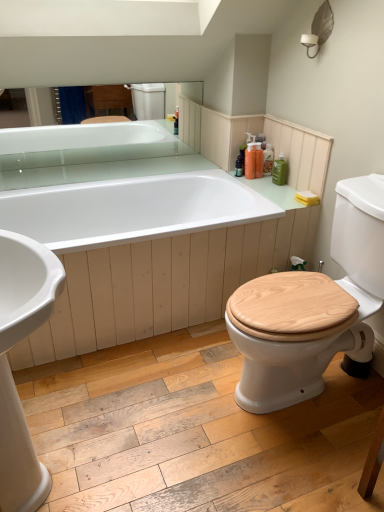
Measure the distance between point (321, 336) and camera.

They are 1.37 meters apart.

Measure the distance between translucent plastic bottles at upper right, which is counted as the second toiletry, starting from the left, and camera.

translucent plastic bottles at upper right, which is counted as the second toiletry, starting from the left, is 7.39 feet from camera.

The image size is (384, 512). Describe the element at coordinates (268, 159) in the screenshot. I see `translucent plastic bottles at upper right, the second toiletry in the right-to-left sequence` at that location.

What is the approximate width of translucent orange bottle at upper right, the third toiletry from the right?

translucent orange bottle at upper right, the third toiletry from the right, is 2.77 inches wide.

Measure the distance between white glossy bathtub at center and camera.

The depth of white glossy bathtub at center is 5.26 feet.

Locate an element on the screen. The width and height of the screenshot is (384, 512). yellow sponge at upper right is located at coordinates (307, 198).

Which point is more forward, (265, 173) or (312, 199)?

The point (312, 199) is in front.

Could you tell me if translucent plastic bottles at upper right, which is counted as the second toiletry, starting from the left, is turned towards yellow sponge at upper right?

No, translucent plastic bottles at upper right, which is counted as the second toiletry, starting from the left, is not facing towards yellow sponge at upper right.

Is translucent plastic bottles at upper right, the second toiletry in the right-to-left sequence, next to yellow sponge at upper right?

translucent plastic bottles at upper right, the second toiletry in the right-to-left sequence, and yellow sponge at upper right are not in contact.

Is translucent plastic bottles at upper right, the second toiletry in the right-to-left sequence, located outside yellow sponge at upper right?

Yes.

Can you tell me how much translucent plastic bottles at upper right, which is counted as the second toiletry, starting from the left, and white glossy bathtub at center differ in facing direction?

They differ by 87.4 degrees in their facing directions.

Is translucent plastic bottles at upper right, the second toiletry in the right-to-left sequence, located outside white glossy bathtub at center?

Indeed, translucent plastic bottles at upper right, the second toiletry in the right-to-left sequence, is completely outside white glossy bathtub at center.

From the image's perspective, who appears lower, translucent plastic bottles at upper right, the second toiletry in the right-to-left sequence, or white glossy bathtub at center?

white glossy bathtub at center appears lower in the image.

From the image's perspective, count 3rd toiletrys upward from the white glossy bathtub at center and point to it. Please provide its 2D coordinates.

[(268, 159)]

Is white glossy bathtub at center further to the viewer compared to wooden at right?

Yes, white glossy bathtub at center is behind wooden at right.

In the image, there is a wooden at right. Where is `bath below it (from a real-world perspective)`? The width and height of the screenshot is (384, 512). bath below it (from a real-world perspective) is located at coordinates (140, 255).

Can you confirm if white glossy bathtub at center is taller than wooden at right?

No.

Could you tell me if translucent plastic bottles at upper right, the second toiletry in the right-to-left sequence, is facing green matte bottle at upper right, the 3th toiletry in the left-to-right sequence?

No, translucent plastic bottles at upper right, the second toiletry in the right-to-left sequence, is not aimed at green matte bottle at upper right, the 3th toiletry in the left-to-right sequence.

Starting from the green matte bottle at upper right, the 1th toiletry viewed from the right, which toiletry is the 1st one to the left? Please provide its 2D coordinates.

[(268, 159)]

Are translucent plastic bottles at upper right, the second toiletry in the right-to-left sequence, and green matte bottle at upper right, the 3th toiletry in the left-to-right sequence, far apart?

They are positioned close to each other.

Is translucent orange bottle at upper right, marked as the first toiletry in a left-to-right arrangement, located outside translucent plastic bottles at upper right, the second toiletry in the right-to-left sequence?

Yes, translucent orange bottle at upper right, marked as the first toiletry in a left-to-right arrangement, is outside of translucent plastic bottles at upper right, the second toiletry in the right-to-left sequence.

Does point (248, 149) appear closer or farther from the camera than point (265, 172)?

Point (248, 149).

From the image's perspective, is translucent orange bottle at upper right, marked as the first toiletry in a left-to-right arrangement, located above or below translucent plastic bottles at upper right, the second toiletry in the right-to-left sequence?

translucent orange bottle at upper right, marked as the first toiletry in a left-to-right arrangement, is below translucent plastic bottles at upper right, the second toiletry in the right-to-left sequence.

Is point (247, 161) less distant than point (310, 313)?

No, (247, 161) is further to viewer.

From a real-world perspective, is translucent orange bottle at upper right, the third toiletry from the right, located higher than wooden at right?

Correct, in the physical world, translucent orange bottle at upper right, the third toiletry from the right, is higher than wooden at right.

Is translucent orange bottle at upper right, the third toiletry from the right, bigger or smaller than wooden at right?

Clearly, translucent orange bottle at upper right, the third toiletry from the right, is smaller in size than wooden at right.

From the image's perspective, which one is positioned higher, translucent orange bottle at upper right, marked as the first toiletry in a left-to-right arrangement, or wooden at right?

translucent orange bottle at upper right, marked as the first toiletry in a left-to-right arrangement.

Is translucent plastic bottles at upper right, the second toiletry in the right-to-left sequence, shorter than translucent orange bottle at upper right, marked as the first toiletry in a left-to-right arrangement?

Incorrect, the height of translucent plastic bottles at upper right, the second toiletry in the right-to-left sequence, does not fall short of that of translucent orange bottle at upper right, marked as the first toiletry in a left-to-right arrangement.

Is translucent plastic bottles at upper right, the second toiletry in the right-to-left sequence, positioned with its back to translucent orange bottle at upper right, marked as the first toiletry in a left-to-right arrangement?

No, translucent plastic bottles at upper right, the second toiletry in the right-to-left sequence, is not facing the opposite direction of translucent orange bottle at upper right, marked as the first toiletry in a left-to-right arrangement.

Is translucent plastic bottles at upper right, the second toiletry in the right-to-left sequence, not near translucent orange bottle at upper right, marked as the first toiletry in a left-to-right arrangement?

translucent plastic bottles at upper right, the second toiletry in the right-to-left sequence, is near translucent orange bottle at upper right, marked as the first toiletry in a left-to-right arrangement, not far away.

Considering the positions of objects translucent plastic bottles at upper right, the second toiletry in the right-to-left sequence, and translucent orange bottle at upper right, marked as the first toiletry in a left-to-right arrangement, in the image provided, who is behind, translucent plastic bottles at upper right, the second toiletry in the right-to-left sequence, or translucent orange bottle at upper right, marked as the first toiletry in a left-to-right arrangement,?

Positioned behind is translucent plastic bottles at upper right, the second toiletry in the right-to-left sequence.

Image resolution: width=384 pixels, height=512 pixels. Find the location of `toilet paper lying on the right of translucent plastic bottles at upper right, the second toiletry in the right-to-left sequence`. toilet paper lying on the right of translucent plastic bottles at upper right, the second toiletry in the right-to-left sequence is located at coordinates (307, 198).

The image size is (384, 512). What are the coordinates of `toiletry that is the 3rd one when counting backward from the white glossy bathtub at center` in the screenshot? It's located at (268, 159).

Looking at the image, which one is located further to white glossy bathtub at center, translucent orange bottle at upper right, the third toiletry from the right, or yellow sponge at upper right?

yellow sponge at upper right is further to white glossy bathtub at center.

Looking at the image, which one is located further to wooden at right, translucent orange bottle at upper right, marked as the first toiletry in a left-to-right arrangement, or white glossy bathtub at center?

Based on the image, translucent orange bottle at upper right, marked as the first toiletry in a left-to-right arrangement, appears to be further to wooden at right.

From the image, which object appears to be nearer to green matte bottle at upper right, the 3th toiletry in the left-to-right sequence, wooden at right or yellow sponge at upper right?

Based on the image, yellow sponge at upper right appears to be nearer to green matte bottle at upper right, the 3th toiletry in the left-to-right sequence.

When comparing their distances from white glossy bathtub at center, does translucent plastic bottles at upper right, which is counted as the second toiletry, starting from the left, or wooden at right seem closer?

wooden at right lies closer to white glossy bathtub at center than the other object.

When comparing their distances from translucent orange bottle at upper right, the third toiletry from the right, does translucent plastic bottles at upper right, the second toiletry in the right-to-left sequence, or yellow sponge at upper right seem further?

yellow sponge at upper right lies further to translucent orange bottle at upper right, the third toiletry from the right, than the other object.

From the image, which object appears to be nearer to white glossy bathtub at center, yellow sponge at upper right or wooden at right?

Based on the image, wooden at right appears to be nearer to white glossy bathtub at center.

Based on their spatial positions, is wooden at right or translucent orange bottle at upper right, the third toiletry from the right, closer to yellow sponge at upper right?

The object closer to yellow sponge at upper right is translucent orange bottle at upper right, the third toiletry from the right.

Looking at the image, which one is located further to green matte bottle at upper right, the 1th toiletry viewed from the right, translucent orange bottle at upper right, marked as the first toiletry in a left-to-right arrangement, or white glossy bathtub at center?

white glossy bathtub at center.

Where is `toilet paper between wooden at right and green matte bottle at upper right, the 1th toiletry viewed from the right, in the front-back direction`? The image size is (384, 512). toilet paper between wooden at right and green matte bottle at upper right, the 1th toiletry viewed from the right, in the front-back direction is located at coordinates (307, 198).

In order to click on toilet paper between wooden at right and translucent orange bottle at upper right, the third toiletry from the right, from front to back in this screenshot , I will do `click(307, 198)`.

You are a GUI agent. You are given a task and a screenshot of the screen. Output one action in this format:
    pyautogui.click(x=<x>, y=<y>)
    Task: Click on the bath located between wooden at right and translucent plastic bottles at upper right, which is counted as the second toiletry, starting from the left, in the depth direction
    The image size is (384, 512).
    Given the screenshot: What is the action you would take?
    pyautogui.click(x=140, y=255)

Identify the location of bath between wooden at right and yellow sponge at upper right from front to back. This screenshot has height=512, width=384. (140, 255).